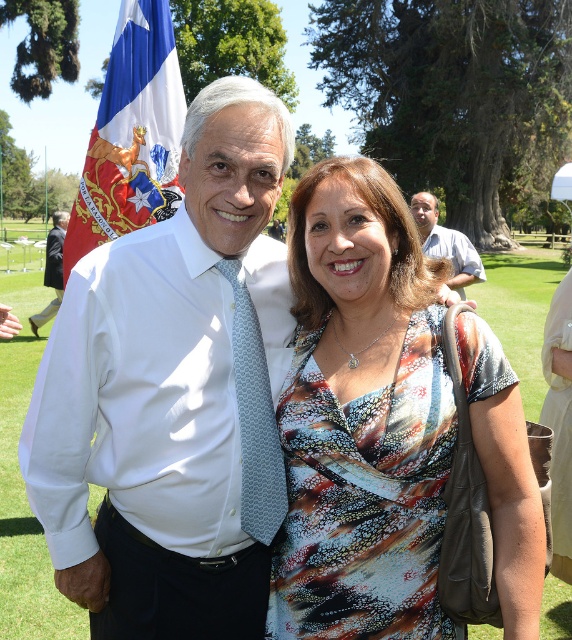
You are standing at point point (177, 304) and want to take a photo of the two people in the scene. The camera you have can focus on subjects within 8 feet. Will the camera be able to capture the two people clearly?

The point (177, 304) and camera are 8.31 feet apart from each other. Since the camera can focus within 8 feet, the distance is slightly beyond the camera range, so it might not capture the two people clearly.

You are a photographer trying to capture a clear shot of the two people in the image. You notice that the white smooth shirt at center and white shirt at center are overlapping. Which one is positioned lower in the frame?

The white smooth shirt at center is located below white shirt at center, so it is positioned lower in the frame.

Based on the scene description, which object is taller between the white smooth shirt at center and the light blue shirt at right?

The white smooth shirt at center is taller than the light blue shirt at right according to the description.